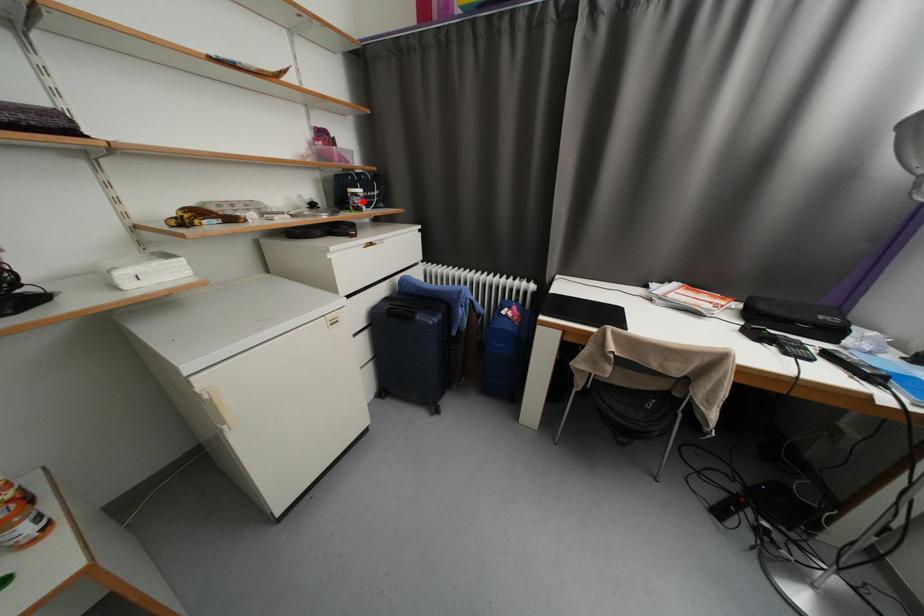
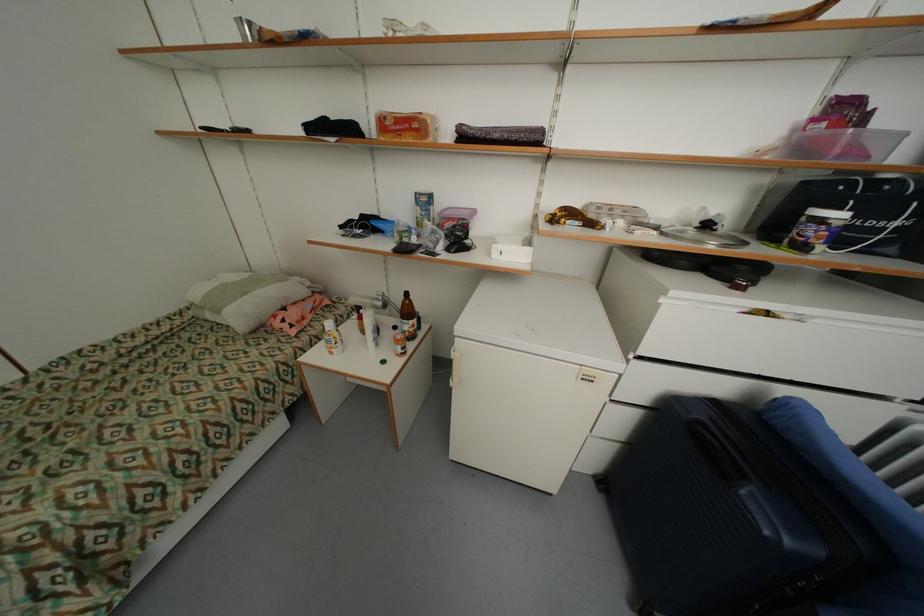
In the second image, find the point that corresponds to the highlighted location in the first image.

(819, 233)